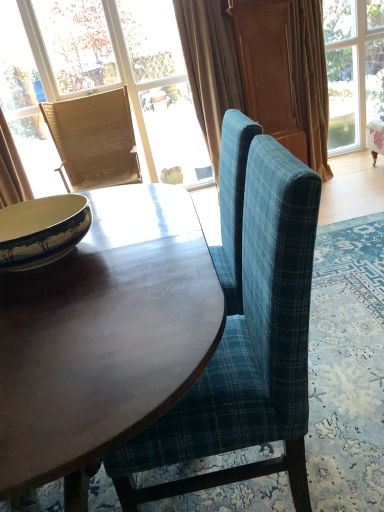
Question: Is yellow glazed bowl at left situated inside silky beige curtain at upper right, arranged as the 3th curtain when viewed from the left, or outside?

Choices:
 (A) outside
 (B) inside

Answer: (A)

Question: From the image's perspective, is yellow glazed bowl at left above or below silky beige curtain at upper right, arranged as the 3th curtain when viewed from the left?

Choices:
 (A) below
 (B) above

Answer: (A)

Question: Which object is the closest to the beige velvet curtain at upper center, which is the 2th curtain in right-to-left order?

Choices:
 (A) silky beige curtain at upper right, arranged as the 3th curtain when viewed from the left
 (B) beige fabric curtain at left, which is the first curtain from left to right
 (C) matte wicker chair at upper left, positioned as the first window in left-to-right order
 (D) matte dark wood desk at center
 (E) wooden screen door at upper center

Answer: (E)

Question: Estimate the real-world distances between objects in this image. Which object is farther from the beige velvet curtain at upper center, which is the 2th curtain in right-to-left order?

Choices:
 (A) yellow glazed bowl at left
 (B) matte wicker chair at upper left, arranged as the 2th window when viewed from the right
 (C) matte dark wood desk at center
 (D) wooden screen door at upper center
 (E) blue plaid fabric chair at center, positioned as the first chair in right-to-left order

Answer: (E)